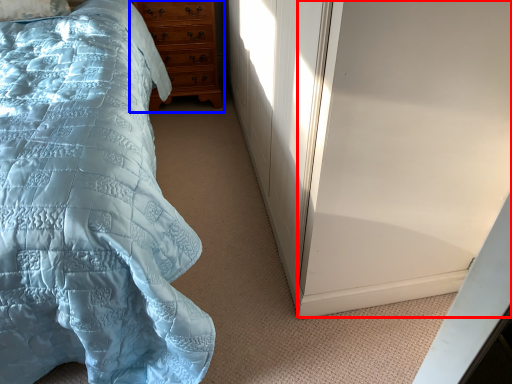
Question: Which point is further to the camera, screen door (highlighted by a red box) or chest of drawers (highlighted by a blue box)?

Choices:
 (A) screen door
 (B) chest of drawers

Answer: (B)